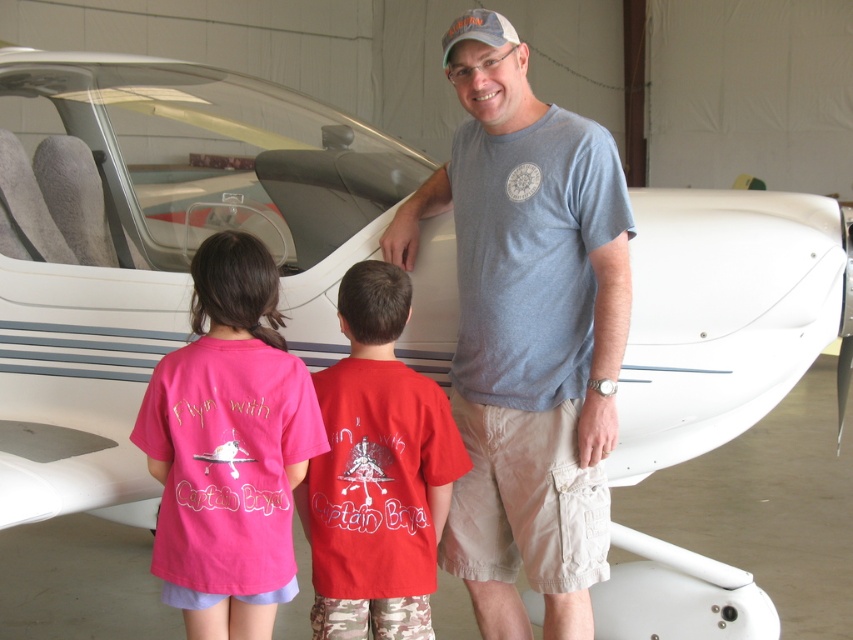
Based on the photo, how distant is pink fabric shirt at center from red cotton shirt at center?

9.06 inches

Who is more distant from viewer, (233,614) or (354,340)?

Point (354,340)

Identify the location of pink fabric shirt at center. Image resolution: width=853 pixels, height=640 pixels. (228, 448).

Locate an element on the screen. This screenshot has width=853, height=640. pink fabric shirt at center is located at coordinates (228, 448).

Who is taller, gray cotton t-shirt at center or pink fabric shirt at center?

Standing taller between the two is gray cotton t-shirt at center.

Which is below, gray cotton t-shirt at center or pink fabric shirt at center?

Positioned lower is pink fabric shirt at center.

Is point (606, 134) positioned after point (167, 461)?

Yes, point (606, 134) is behind point (167, 461).

Where is `gray cotton t-shirt at center`? This screenshot has width=853, height=640. gray cotton t-shirt at center is located at coordinates (527, 332).

Does gray cotton t-shirt at center have a lesser height compared to red cotton shirt at center?

No, gray cotton t-shirt at center is not shorter than red cotton shirt at center.

Is gray cotton t-shirt at center above red cotton shirt at center?

Yes, gray cotton t-shirt at center is above red cotton shirt at center.

Does point (431, 196) lie in front of point (422, 588)?

No, it is behind (422, 588).

Find the location of a particular element. gray cotton t-shirt at center is located at coordinates (527, 332).